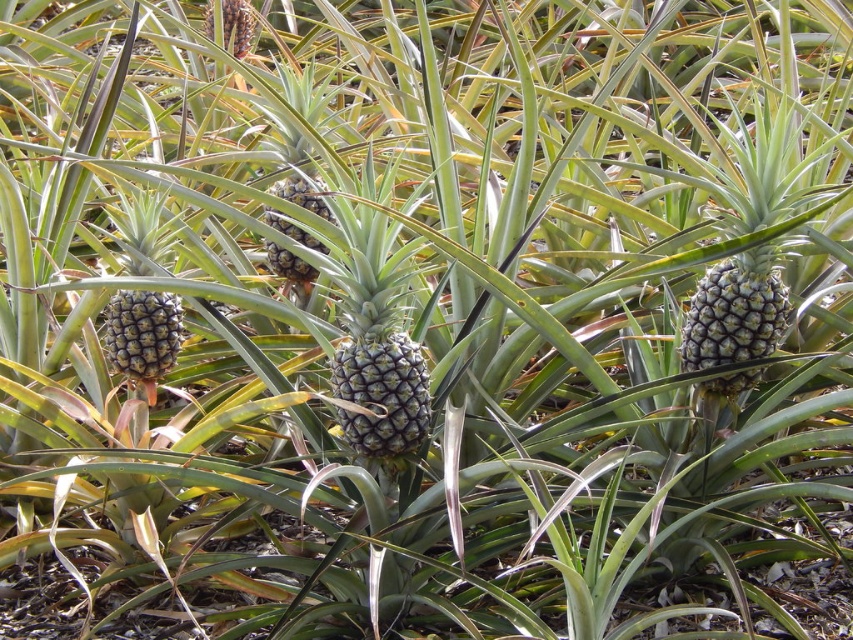
Question: In this image, where is green spiky pineapple at right located relative to green textured pineapple at center?

Choices:
 (A) right
 (B) left

Answer: (A)

Question: Which is farther from the green textured pineapple at left?

Choices:
 (A) green textured pineapple at center
 (B) green spiky pineapple at right

Answer: (B)

Question: Which point is farther to the camera?

Choices:
 (A) (151, 234)
 (B) (718, 388)
 (C) (306, 262)

Answer: (C)

Question: Among these objects, which one is nearest to the camera?

Choices:
 (A) spongy brown pineapple at upper center
 (B) green textured pineapple at left

Answer: (B)

Question: Does green textured pineapple at left have a smaller size compared to spongy brown pineapple at upper center?

Choices:
 (A) no
 (B) yes

Answer: (B)

Question: Is green textured pineapple at left thinner than green textured pineapple at center?

Choices:
 (A) no
 (B) yes

Answer: (B)